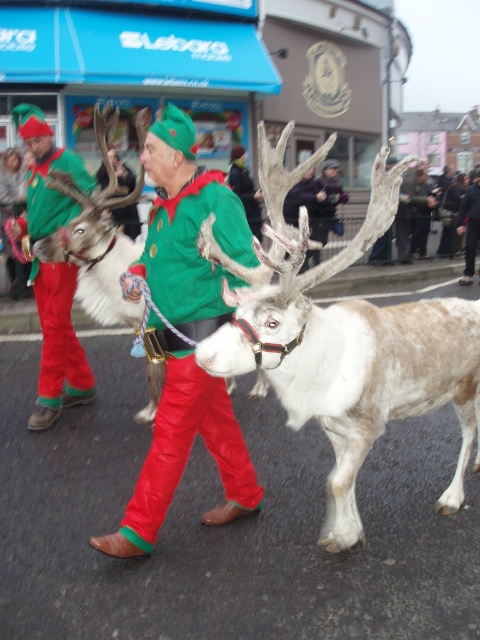
Question: Is white speckled fur at center positioned before matte green costume at center?

Choices:
 (A) yes
 (B) no

Answer: (A)

Question: Can you confirm if white speckled fur at center is positioned below matte green costume at center?

Choices:
 (A) no
 (B) yes

Answer: (B)

Question: Which of the following is the closest to the observer?

Choices:
 (A) white speckled fur at center
 (B) matte green costume at center

Answer: (A)

Question: Can you confirm if white speckled fur at center is positioned below matte green costume at center?

Choices:
 (A) no
 (B) yes

Answer: (B)